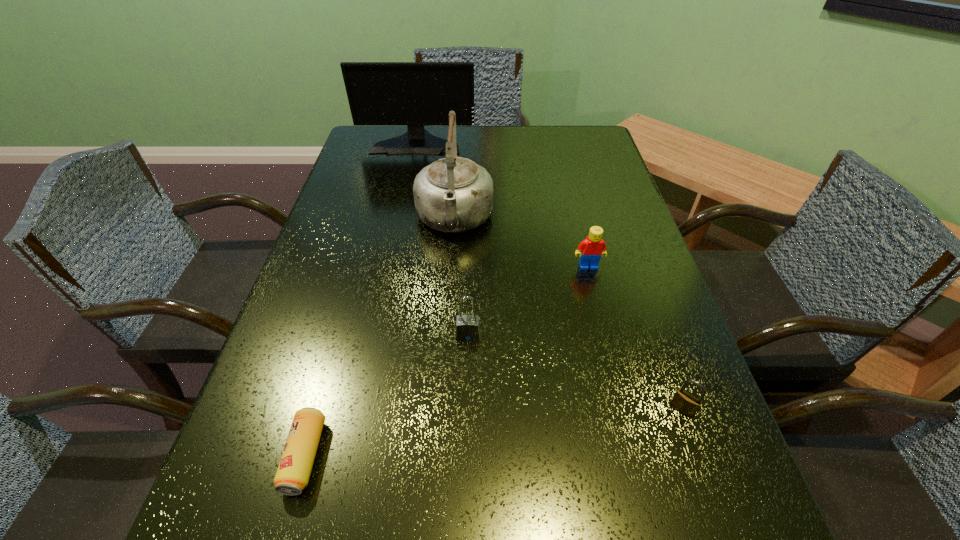
Locate an element on the screen. padlock located in the right edge section of the desktop is located at coordinates click(x=683, y=401).

What are the coordinates of `object at the far left corner` in the screenshot? It's located at (415, 94).

In the image, there is a desktop. Identify the location of free space at the left edge. The image size is (960, 540). (320, 285).

What are the coordinates of `vacant space at the right edge of the desktop` in the screenshot? It's located at click(x=684, y=365).

Locate an element on the screen. The image size is (960, 540). free region at the far left corner is located at coordinates (373, 156).

In the image, there is a desktop. At what (x,y) coordinates should I click in order to perform the action: click on free space at the far right corner. Please return your answer as a coordinate pair (x, y). Image resolution: width=960 pixels, height=540 pixels. Looking at the image, I should click on [x=588, y=163].

Where is `empty space that is in between the nearer padlock and the fifth nearest object`? This screenshot has width=960, height=540. empty space that is in between the nearer padlock and the fifth nearest object is located at coordinates (568, 314).

Locate an element on the screen. This screenshot has height=540, width=960. vacant point located between the farthest object and the taller padlock is located at coordinates (443, 239).

Find the location of a particular element. This screenshot has height=540, width=960. free space between the fifth nearest object and the beer can is located at coordinates (379, 338).

Find the location of a particular element. This screenshot has height=540, width=960. empty location between the second farthest object and the rightmost object is located at coordinates (568, 314).